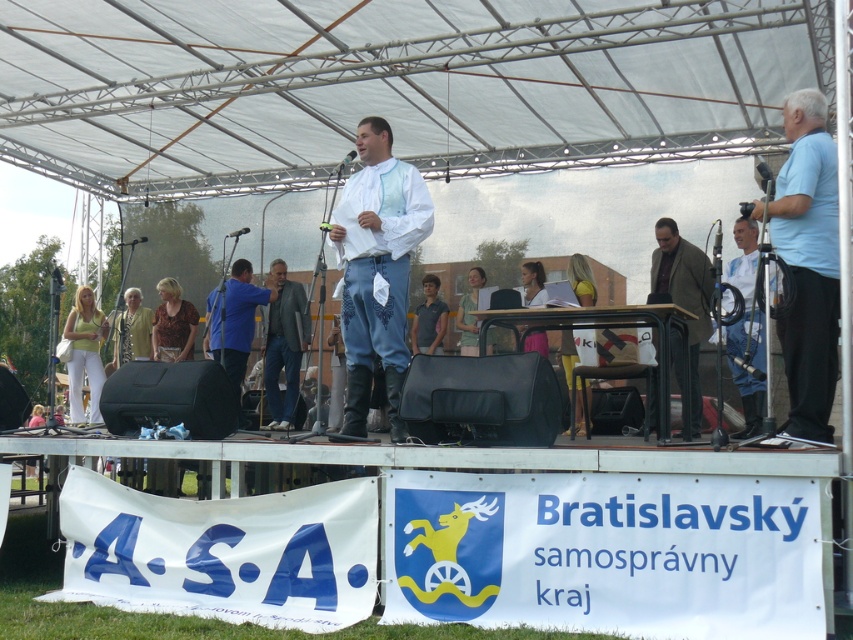
You are organizing a photo shoot and need to arrange two models wearing the white cotton shirt at center and the brown printed blouse at center. Since you want them to be visible to the audience, which model should stand closer to the back so that both are equally visible?

The white cotton shirt at center is larger in size compared to the brown printed blouse at center. To ensure both are equally visible, the smaller brown printed blouse at center should stand closer to the front, while the larger white cotton shirt at center can be positioned slightly further back.

Based on the photo, you are attending the outdoor event and want to take a photo of both the matte yellow blouse at lower left and the light green fabric dress at center. Which one should you position to the left in your camera frame to capture both in the same shot?

The matte yellow blouse at lower left is already positioned to the left of the light green fabric dress at center, so you should keep the matte yellow blouse at lower left on the left side of your camera frame to include both in the photo.

Where is the white cotton shirt at center located in the image?

The white cotton shirt at center is located at point (x=378, y=272).